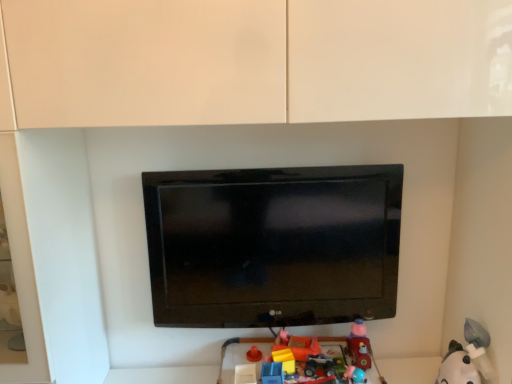
Image resolution: width=512 pixels, height=384 pixels. Find the location of `empty space that is ontop of black glossy tv at center (from a real-world perspective)`. empty space that is ontop of black glossy tv at center (from a real-world perspective) is located at coordinates (291, 164).